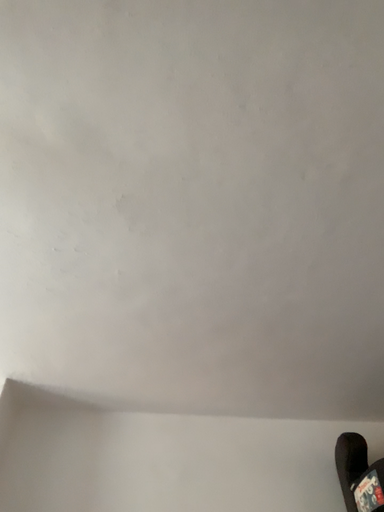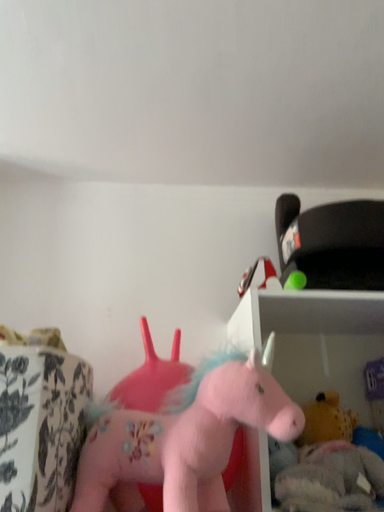
Question: Which way did the camera rotate in the video?

Choices:
 (A) rotated upward
 (B) rotated downward

Answer: (B)